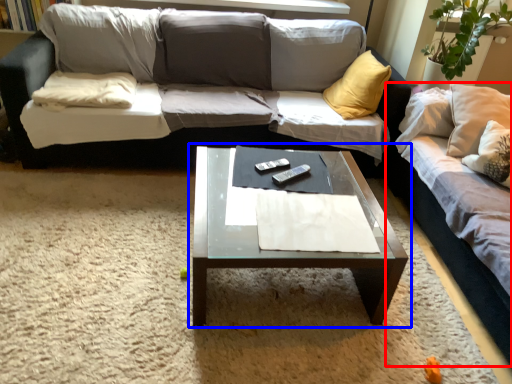
Question: Which of the following is the closest to the observer, studio couch (highlighted by a red box) or coffee table (highlighted by a blue box)?

Choices:
 (A) studio couch
 (B) coffee table

Answer: (A)